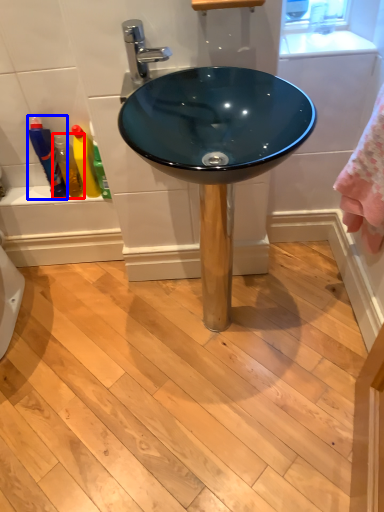
Question: Which of the following is the farthest to the observer, toiletry (highlighted by a red box) or bottle (highlighted by a blue box)?

Choices:
 (A) toiletry
 (B) bottle

Answer: (A)